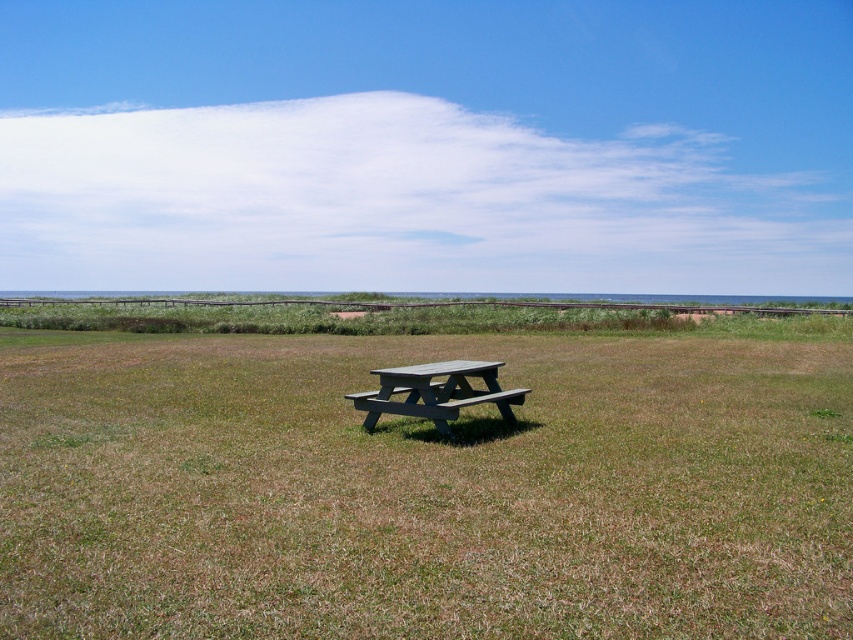
You are standing at the edge of the scene and want to walk towards the gray wood picnic table at center. Which direction should you move to get closer to it while avoiding the green grass at center?

The green grass at center is closer to the viewer than the gray wood picnic table at center, so to reach the picnic table while avoiding the grass, you should move towards the right or left to bypass the grassy area.